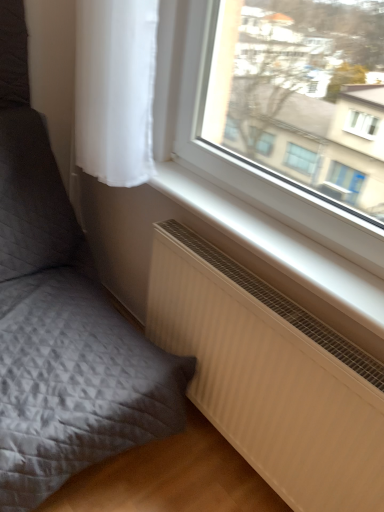
Question: Could matte gray cushion at lower left be considered to be inside white sheer curtain at upper left?

Choices:
 (A) yes
 (B) no

Answer: (B)

Question: Can we say white sheer curtain at upper left lies outside matte gray cushion at lower left?

Choices:
 (A) yes
 (B) no

Answer: (A)

Question: From a real-world perspective, does white sheer curtain at upper left sit lower than matte gray cushion at lower left?

Choices:
 (A) yes
 (B) no

Answer: (B)

Question: Is white sheer curtain at upper left to the right of matte gray cushion at lower left from the viewer's perspective?

Choices:
 (A) yes
 (B) no

Answer: (A)

Question: From the image's perspective, is white sheer curtain at upper left above matte gray cushion at lower left?

Choices:
 (A) no
 (B) yes

Answer: (B)

Question: Do you think white sheer curtain at upper left is within white matte window sill at lower center, or outside of it?

Choices:
 (A) inside
 (B) outside

Answer: (B)

Question: In terms of width, does white sheer curtain at upper left look wider or thinner when compared to white matte window sill at lower center?

Choices:
 (A) thin
 (B) wide

Answer: (B)

Question: From a real-world perspective, is white sheer curtain at upper left positioned above or below white matte window sill at lower center?

Choices:
 (A) above
 (B) below

Answer: (A)

Question: Considering the positions of point pos(125,134) and point pos(319,292), is point pos(125,134) closer or farther from the camera than point pos(319,292)?

Choices:
 (A) farther
 (B) closer

Answer: (A)

Question: From a real-world perspective, is matte gray cushion at lower left positioned above or below white sheer curtain at upper left?

Choices:
 (A) below
 (B) above

Answer: (A)

Question: In terms of width, does matte gray cushion at lower left look wider or thinner when compared to white sheer curtain at upper left?

Choices:
 (A) wide
 (B) thin

Answer: (A)

Question: From the image's perspective, is matte gray cushion at lower left located above or below white sheer curtain at upper left?

Choices:
 (A) below
 (B) above

Answer: (A)

Question: Based on their positions, is matte gray cushion at lower left located to the left or right of white sheer curtain at upper left?

Choices:
 (A) right
 (B) left

Answer: (B)

Question: From a real-world perspective, is white matte window sill at lower center above or below matte gray cushion at lower left?

Choices:
 (A) below
 (B) above

Answer: (B)

Question: From the image's perspective, relative to matte gray cushion at lower left, is white matte window sill at lower center above or below?

Choices:
 (A) above
 (B) below

Answer: (A)